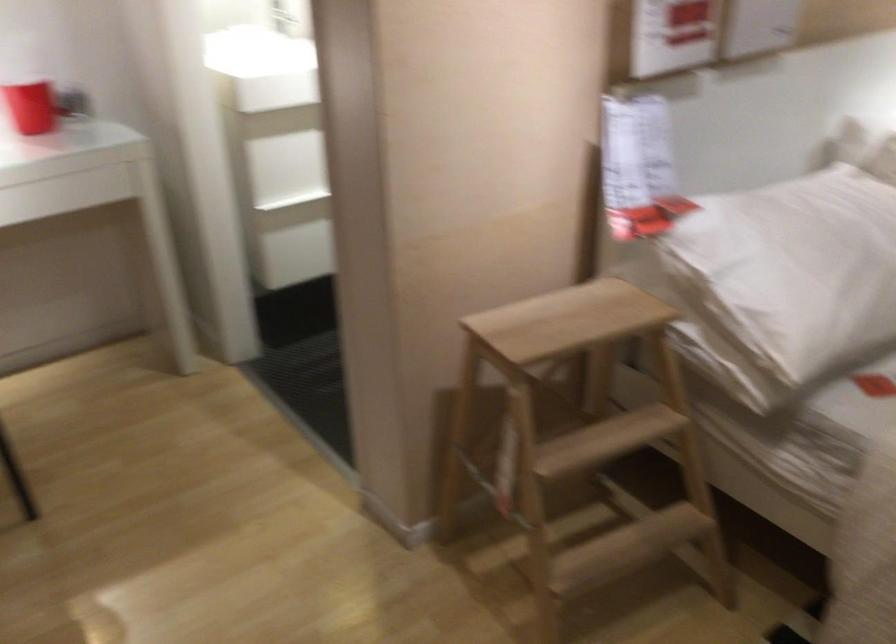
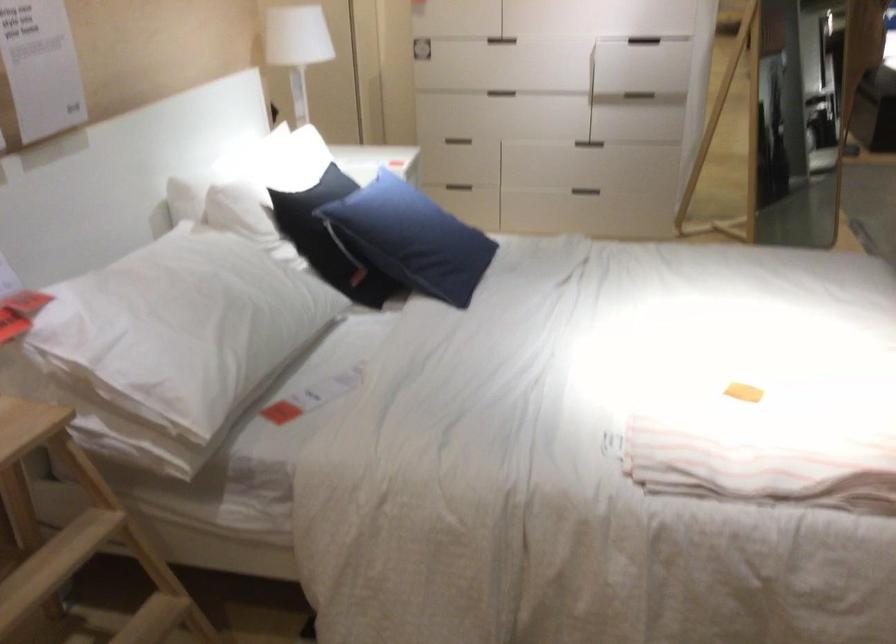
Question: The first image is from the beginning of the video and the second image is from the end. How did the camera likely rotate when shooting the video?

Choices:
 (A) Left
 (B) Right
 (C) Up
 (D) Down

Answer: (B)